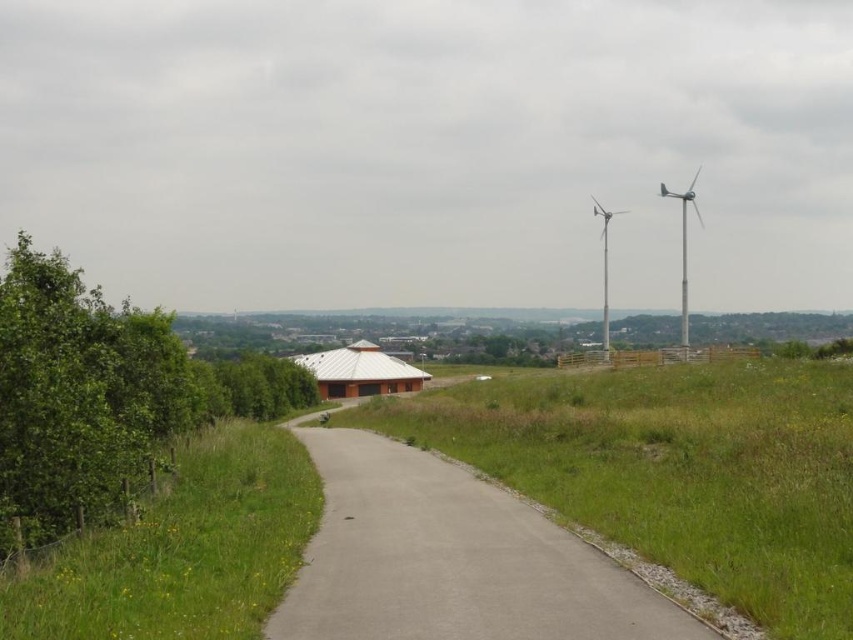
What are the coordinates of `gray asphalt path at center` in the screenshot? It's located at (451, 557).

Who is shorter, gray asphalt path at center or silver metallic wind turbine at upper right?

With less height is gray asphalt path at center.

You are a GUI agent. You are given a task and a screenshot of the screen. Output one action in this format:
    pyautogui.click(x=<x>, y=<y>)
    Task: Click on the gray asphalt path at center
    The height and width of the screenshot is (640, 853).
    Given the screenshot: What is the action you would take?
    pyautogui.click(x=451, y=557)

Who is higher up, gray asphalt path at center or silver metallic wind turbine at center-right?

silver metallic wind turbine at center-right

Does gray asphalt path at center appear on the right side of silver metallic wind turbine at center-right?

In fact, gray asphalt path at center is to the left of silver metallic wind turbine at center-right.

Which is behind, point (677, 616) or point (608, 323)?

The point (608, 323) is more distant.

Image resolution: width=853 pixels, height=640 pixels. What are the coordinates of `gray asphalt path at center` in the screenshot? It's located at (451, 557).

Does silver metallic wind turbine at upper right come behind silver metallic wind turbine at center-right?

Yes.

Which is in front, point (689, 184) or point (608, 330)?

Positioned in front is point (608, 330).

Which is in front, point (693, 180) or point (602, 246)?

Positioned in front is point (602, 246).

This screenshot has height=640, width=853. In order to click on silver metallic wind turbine at upper right in this screenshot , I will do `click(683, 248)`.